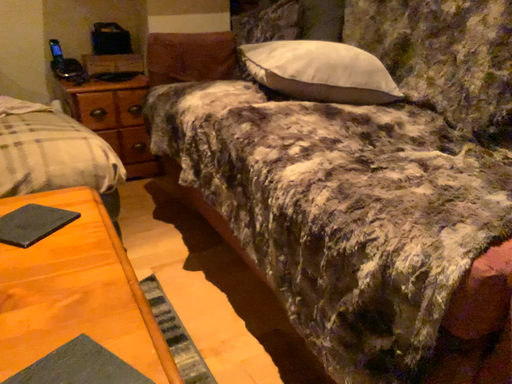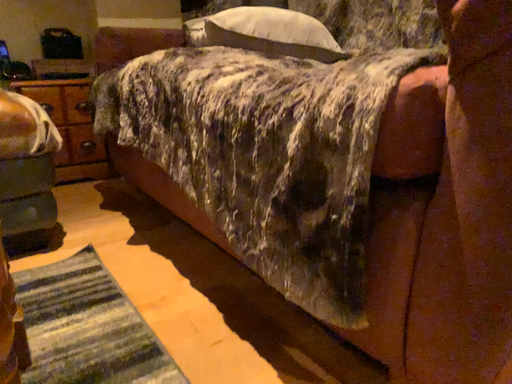
Question: Which way did the camera rotate in the video?

Choices:
 (A) rotated upward
 (B) rotated downward

Answer: (A)